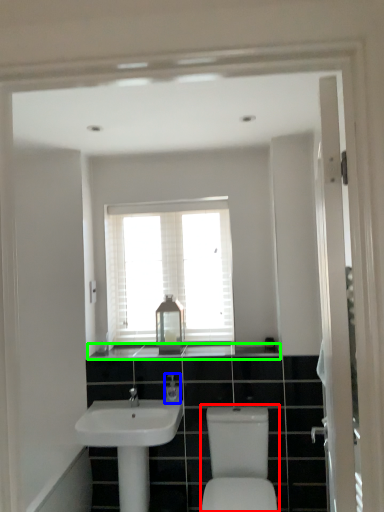
Question: Which object is positioned farthest from sink (highlighted by a red box)? Select from toiletry (highlighted by a blue box) and counter top (highlighted by a green box).

Choices:
 (A) toiletry
 (B) counter top

Answer: (B)